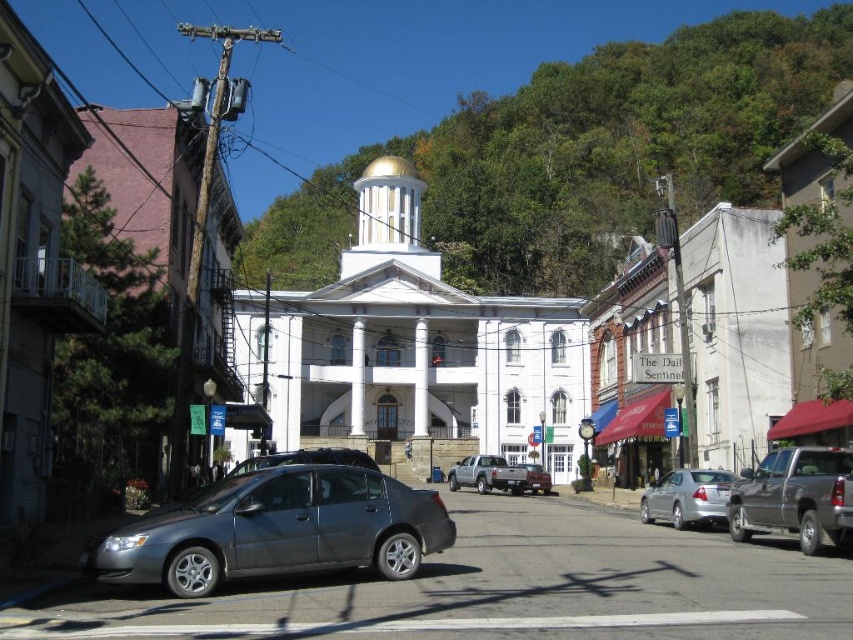
You are a delivery person needing to park your vehicle in a tight space between two buildings. You have a silver metallic truck at center and a matte red truck at center. Which truck would you choose to park in the space if you need the smaller vehicle for better maneuverability?

The matte red truck at center is smaller, so it would be better for maneuvering in tight spaces.

You are a visitor standing at the entrance of the town square. You see the white glossy church at center and the satin gray sedan at lower left. Which object is positioned higher relative to the other?

The white glossy church at center is located above the satin gray sedan at lower left, so it is positioned higher.

You are a tourist standing next to the satin gray sedan at lower left and want to take a photo of the white glossy church at center. Is the church within your camera lens range if your camera has a 50mm focal length?

The distance between the white glossy church at center and the satin gray sedan at lower left is 70.46 meters. A 50mm focal length on a standard camera typically has an angle of view that can capture subjects within about 50 meters. Therefore, the white glossy church at center is beyond the camera lens range of 50mm focal length.